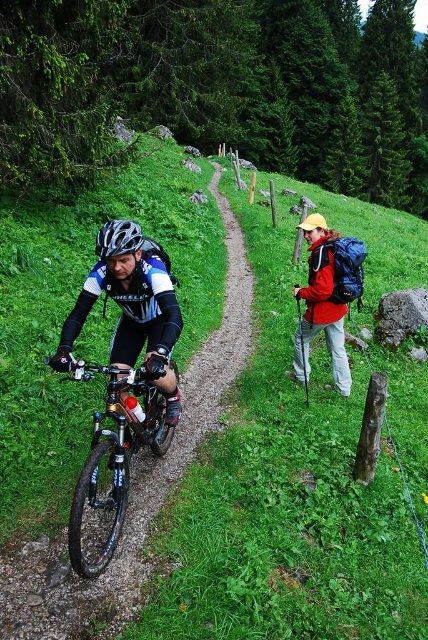
You are standing at the point marked by the coordinates point (131, 307) in the forest. What object is located exactly at this point?

The point (131, 307) corresponds to the shiny black bicycle at center.

You are a hiker on the dirt path and see the shiny black bicycle at center and the matte black jacket at right. Which object is closer to you?

The shiny black bicycle at center is closer to you because it is in front of the matte black jacket at right.

You are a hiker on the dirt path and want to know which object is closer to you. The shiny metallic bicycle at left and the matte black jacket at right are both visible. Which one is nearer?

The shiny metallic bicycle at left is smaller than the matte black jacket at right, so it appears closer to you.